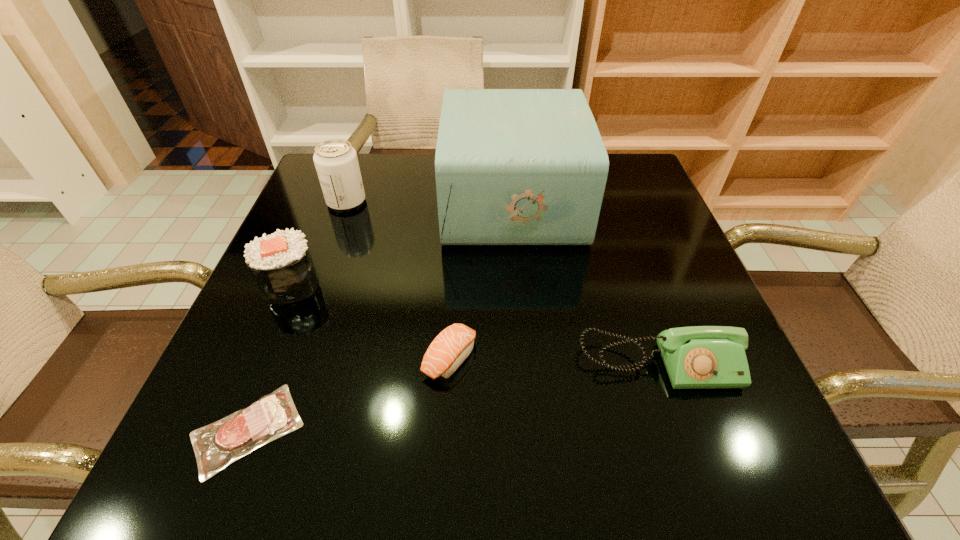
Choose which object is the second nearest neighbor to the second shortest object. Please provide its 2D coordinates. Your answer should be formatted as a tuple, i.e. [(x, y)], where the tuple contains the x and y coordinates of a point satisfying the conditions above.

[(699, 357)]